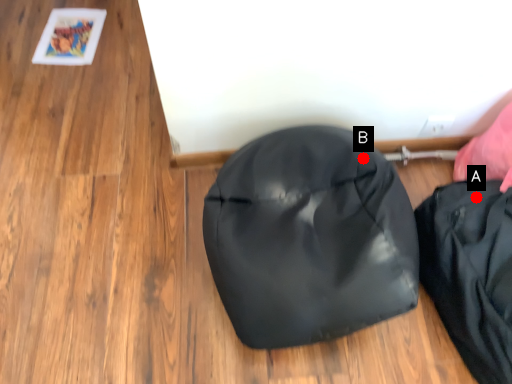
Question: Two points are circled on the image, labeled by A and B beside each circle. Which point is further to the camera?

Choices:
 (A) A is further
 (B) B is further

Answer: (B)